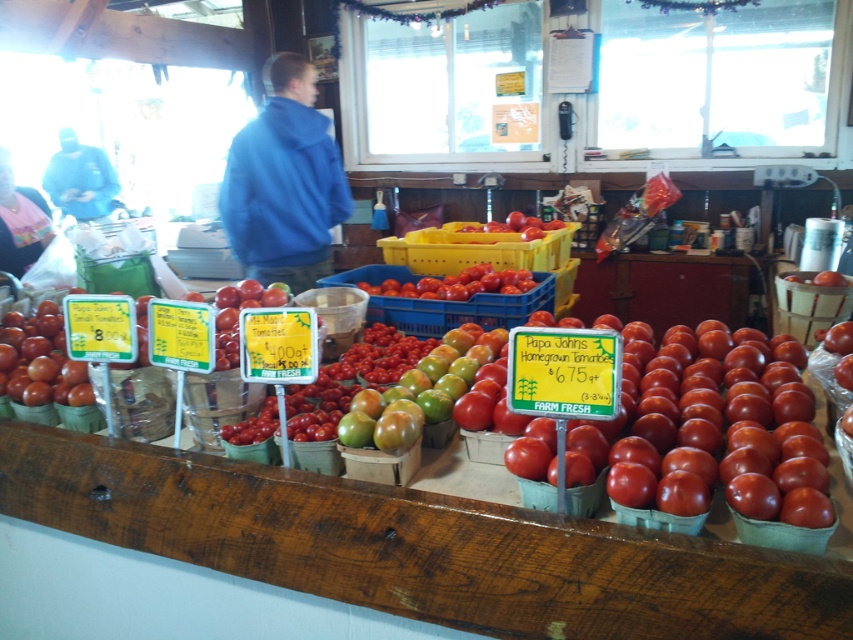
Question: Which point is farther to the camera?

Choices:
 (A) (256, 260)
 (B) (49, 184)
 (C) (389, 404)
 (D) (0, 253)

Answer: (B)

Question: Which object is farther from the camera taking this photo?

Choices:
 (A) matte blue hoodie at left
 (B) green matte tomatoes at center
 (C) blue fleece jacket at center

Answer: (A)

Question: Can you confirm if blue fleece jacket at center is smaller than green matte tomatoes at center?

Choices:
 (A) yes
 (B) no

Answer: (B)

Question: In this image, where is blue fleece jacket at center located relative to pink fabric at left?

Choices:
 (A) right
 (B) left

Answer: (A)

Question: Which object is positioned closest to the green matte tomatoes at center?

Choices:
 (A) shiny red tomatoes at center
 (B) pink fabric at left

Answer: (A)

Question: In this image, where is pink fabric at left located relative to shiny red tomatoes at center?

Choices:
 (A) right
 (B) left

Answer: (B)